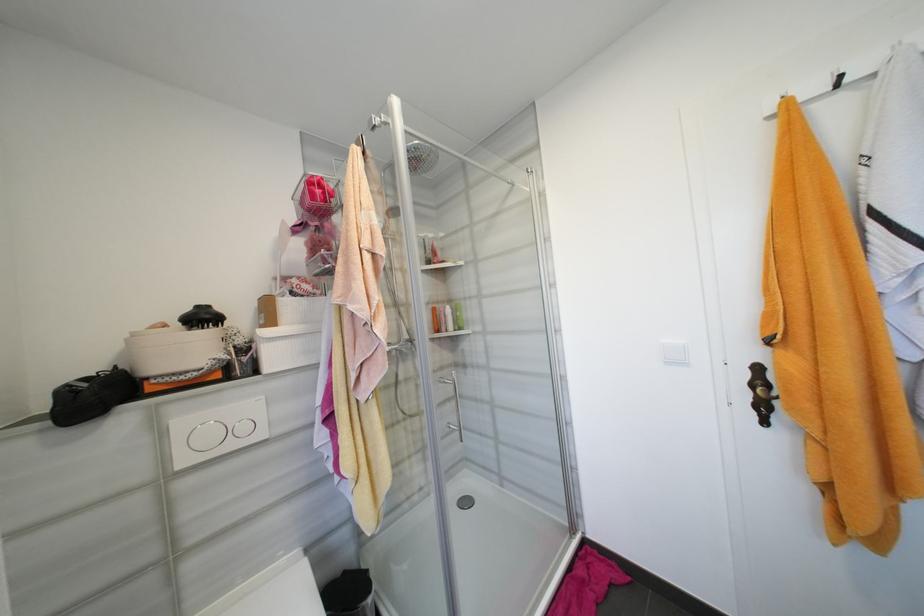
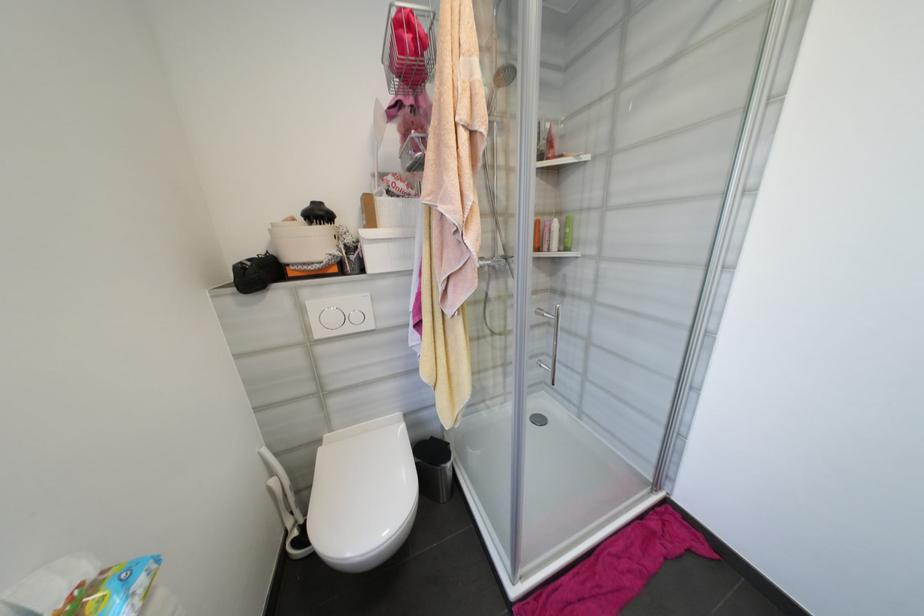
Locate, in the second image, the point that corresponds to point (140, 334) in the first image.

(280, 225)